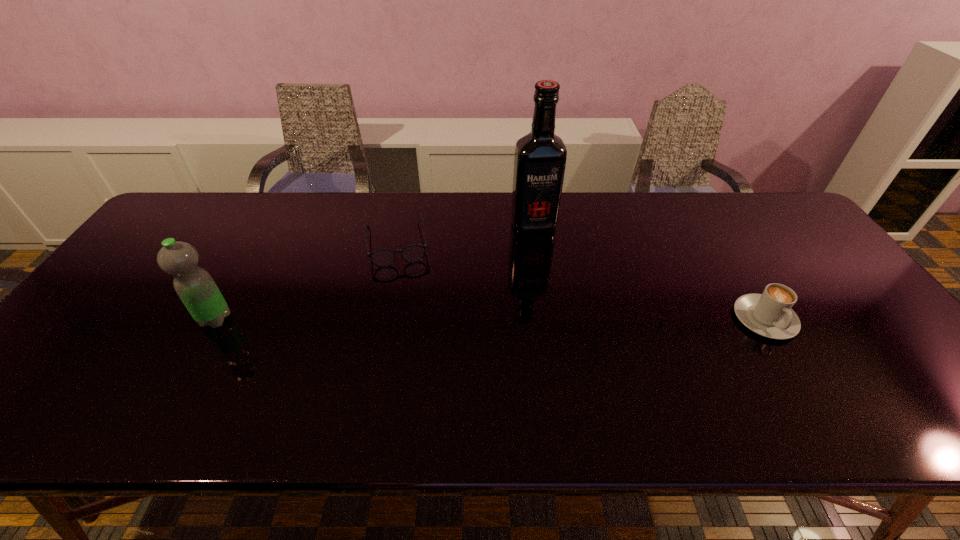
Identify the location of free space on the desktop that is between the water bottle and the cappuccino and is positioned on the front-facing side of the shortest object. Image resolution: width=960 pixels, height=540 pixels. (409, 319).

Where is `free spot on the desktop that is between the second tallest object and the rightmost object and is positioned on the front-facing side of the liquor`? This screenshot has height=540, width=960. free spot on the desktop that is between the second tallest object and the rightmost object and is positioned on the front-facing side of the liquor is located at coordinates (564, 319).